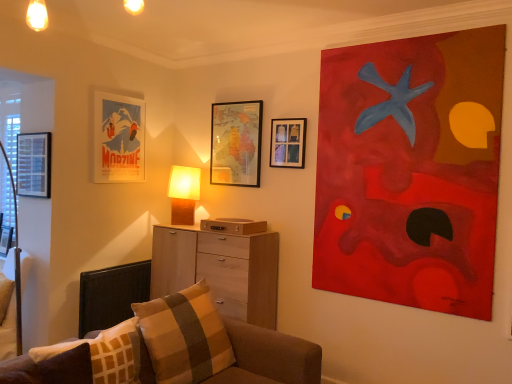
What is the approximate height of brown plaid pillow at lower left, which is the second pillow from back to front?

It is 13.04 inches.

Describe the element at coordinates (184, 336) in the screenshot. I see `plaid fabric pillow at lower center, the 2th pillow viewed from the front` at that location.

Image resolution: width=512 pixels, height=384 pixels. I want to click on black fabric swivel chair at lower left, so click(x=111, y=295).

The height and width of the screenshot is (384, 512). Describe the element at coordinates (220, 270) in the screenshot. I see `light wood chest of drawers at center` at that location.

Measure the distance between point [167,243] and camera.

Point [167,243] and camera are 3.54 meters apart from each other.

Identify the location of wooden map at upper center, acting as the 4th picture frame starting from the left. Image resolution: width=512 pixels, height=384 pixels. (236, 143).

Looking at this image, which is closer to the camera, (349, 156) or (103, 111)?

Point (349, 156) is positioned closer to the camera compared to point (103, 111).

This screenshot has height=384, width=512. In order to click on picture frame that is the 3rd object located in front of the matte paper poster at upper left, arranged as the fourth picture frame when viewed from the right in this screenshot , I will do `click(410, 171)`.

Considering the sizes of objects acrylic painting at upper right, the sixth picture frame in the left-to-right sequence, and matte paper poster at upper left, which is counted as the 3th picture frame, starting from the left, in the image provided, who is thinner, acrylic painting at upper right, the sixth picture frame in the left-to-right sequence, or matte paper poster at upper left, which is counted as the 3th picture frame, starting from the left,?

With smaller width is matte paper poster at upper left, which is counted as the 3th picture frame, starting from the left.

Is point (174, 243) closer or farther from the camera than point (109, 95)?

Point (174, 243) appears to be farther away from the viewer than point (109, 95).

Considering the relative sizes of light wood chest of drawers at center and matte paper poster at upper left, arranged as the fourth picture frame when viewed from the right, in the image provided, is light wood chest of drawers at center wider than matte paper poster at upper left, arranged as the fourth picture frame when viewed from the right,?

Yes.

Is the position of light wood chest of drawers at center more distant than that of matte paper poster at upper left, which is counted as the 3th picture frame, starting from the left?

That is False.

Can you confirm if acrylic painting at upper right, the sixth picture frame in the left-to-right sequence, is taller than matte black picture frame at left, the 2th picture frame viewed from the left?

Indeed, acrylic painting at upper right, the sixth picture frame in the left-to-right sequence, has a greater height compared to matte black picture frame at left, the 2th picture frame viewed from the left.

Which point is more distant from viewer, (359, 254) or (23, 167)?

The point (23, 167) is behind.

How different are the orientations of acrylic painting at upper right, the sixth picture frame in the left-to-right sequence, and matte black picture frame at left, the 5th picture frame when ordered from right to left, in degrees?

The angle between the facing direction of acrylic painting at upper right, the sixth picture frame in the left-to-right sequence, and the facing direction of matte black picture frame at left, the 5th picture frame when ordered from right to left, is 0.594 degrees.

Is acrylic painting at upper right, which is the 1th picture frame from right to left, aimed at matte black picture frame at left, the 5th picture frame when ordered from right to left?

No, acrylic painting at upper right, which is the 1th picture frame from right to left, is not aimed at matte black picture frame at left, the 5th picture frame when ordered from right to left.

Does brown fabric couch at lower right have a greater height compared to light wood chest of drawers at center?

No, brown fabric couch at lower right is not taller than light wood chest of drawers at center.

Is light wood chest of drawers at center located within brown fabric couch at lower right?

No.

Measure the distance from brown fabric couch at lower right to light wood chest of drawers at center.

brown fabric couch at lower right and light wood chest of drawers at center are 30.38 inches apart from each other.

Is brown fabric couch at lower right in contact with light wood chest of drawers at center?

No, brown fabric couch at lower right is not touching light wood chest of drawers at center.

Considering the sizes of objects matte black picture frame at left, the 5th picture frame when ordered from right to left, and plaid fabric pillow at lower center, the first pillow from the back, in the image provided, who is wider, matte black picture frame at left, the 5th picture frame when ordered from right to left, or plaid fabric pillow at lower center, the first pillow from the back,?

plaid fabric pillow at lower center, the first pillow from the back, is wider.

Does point (48, 186) lie behind point (136, 312)?

Yes, it is behind point (136, 312).

Is plaid fabric pillow at lower center, the 2th pillow viewed from the front, a part of matte black picture frame at left, the 2th picture frame viewed from the left?

No, plaid fabric pillow at lower center, the 2th pillow viewed from the front, is not surrounded by matte black picture frame at left, the 2th picture frame viewed from the left.

From the image's perspective, which object appears higher, matte black picture frame at left, the 5th picture frame when ordered from right to left, or plaid fabric pillow at lower center, the first pillow from the back?

matte black picture frame at left, the 5th picture frame when ordered from right to left, from the image's perspective.

Is brown fabric couch at lower right positioned before wooden map at upper center, acting as the third picture frame starting from the right?

Yes.

Based on the photo, from a real-world perspective, is brown fabric couch at lower right under wooden map at upper center, acting as the third picture frame starting from the right?

Indeed, from a real-world perspective, brown fabric couch at lower right is positioned beneath wooden map at upper center, acting as the third picture frame starting from the right.

Is brown fabric couch at lower right bigger than wooden map at upper center, acting as the 4th picture frame starting from the left?

Correct, brown fabric couch at lower right is larger in size than wooden map at upper center, acting as the 4th picture frame starting from the left.

Would you say brown fabric couch at lower right is a long distance from wooden map at upper center, acting as the 4th picture frame starting from the left?

Yes, brown fabric couch at lower right is far from wooden map at upper center, acting as the 4th picture frame starting from the left.

From a real-world perspective, which is physically above, light wood chest of drawers at center or wooden map at upper center, acting as the 4th picture frame starting from the left?

From a 3D spatial view, wooden map at upper center, acting as the 4th picture frame starting from the left, is above.

Is there a large distance between light wood chest of drawers at center and wooden map at upper center, acting as the third picture frame starting from the right?

That's not correct — light wood chest of drawers at center is a little close to wooden map at upper center, acting as the third picture frame starting from the right.

Does light wood chest of drawers at center have a lesser height compared to wooden map at upper center, acting as the 4th picture frame starting from the left?

Incorrect, the height of light wood chest of drawers at center does not fall short of that of wooden map at upper center, acting as the 4th picture frame starting from the left.

Starting from the acrylic painting at upper right, which is the 1th picture frame from right to left, which picture frame is the 3rd one behind? Please provide its 2D coordinates.

[(119, 137)]

In order to click on chest of drawers to the right of matte paper poster at upper left, arranged as the fourth picture frame when viewed from the right in this screenshot , I will do `click(220, 270)`.

Based on their spatial positions, is brown plaid pillow at lower left, arranged as the 1th pillow when viewed from the front, or wooden map at upper center, acting as the 4th picture frame starting from the left, closer to plaid fabric pillow at lower center, the first pillow from the back?

brown plaid pillow at lower left, arranged as the 1th pillow when viewed from the front, lies closer to plaid fabric pillow at lower center, the first pillow from the back, than the other object.

Which object lies nearer to the anchor point matte paper poster at upper left, arranged as the fourth picture frame when viewed from the right, matte wooden table lamp at center or metallic silver picture frame at left, positioned as the sixth picture frame in right-to-left order?

Among the two, matte wooden table lamp at center is located nearer to matte paper poster at upper left, arranged as the fourth picture frame when viewed from the right.

Estimate the real-world distances between objects in this image. Which object is further from light wood chest of drawers at center, matte paper poster at upper left, which is counted as the 3th picture frame, starting from the left, or black fabric swivel chair at lower left?

matte paper poster at upper left, which is counted as the 3th picture frame, starting from the left, lies further to light wood chest of drawers at center than the other object.

Looking at the image, which one is located closer to matte wooden picture frame at upper center, acting as the 5th picture frame starting from the left, matte paper poster at upper left, which is counted as the 3th picture frame, starting from the left, or brown plaid pillow at lower left, which is the second pillow from back to front?

Based on the image, matte paper poster at upper left, which is counted as the 3th picture frame, starting from the left, appears to be nearer to matte wooden picture frame at upper center, acting as the 5th picture frame starting from the left.

From the image, which object appears to be nearer to brown fabric couch at lower right, matte paper poster at upper left, arranged as the fourth picture frame when viewed from the right, or black fabric swivel chair at lower left?

black fabric swivel chair at lower left lies closer to brown fabric couch at lower right than the other object.

Looking at the image, which one is located closer to metallic silver picture frame at left, positioned as the sixth picture frame in right-to-left order, matte black picture frame at left, the 2th picture frame viewed from the left, or plaid fabric pillow at lower center, the 2th pillow viewed from the front?

Among the two, matte black picture frame at left, the 2th picture frame viewed from the left, is located nearer to metallic silver picture frame at left, positioned as the sixth picture frame in right-to-left order.

Looking at this image, estimate the real-world distances between objects in this image. Which object is closer to acrylic painting at upper right, the sixth picture frame in the left-to-right sequence, matte wooden picture frame at upper center, acting as the 5th picture frame starting from the left, or matte black picture frame at left, the 2th picture frame viewed from the left?

matte wooden picture frame at upper center, acting as the 5th picture frame starting from the left, is closer to acrylic painting at upper right, the sixth picture frame in the left-to-right sequence.

Considering their positions, is wooden map at upper center, acting as the 4th picture frame starting from the left, positioned closer to brown plaid pillow at lower left, which is the second pillow from back to front, than acrylic painting at upper right, the sixth picture frame in the left-to-right sequence?

Based on the image, wooden map at upper center, acting as the 4th picture frame starting from the left, appears to be nearer to brown plaid pillow at lower left, which is the second pillow from back to front.

Where is `the chest of drawers situated between matte black picture frame at left, the 5th picture frame when ordered from right to left, and acrylic painting at upper right, the sixth picture frame in the left-to-right sequence, from left to right`? The image size is (512, 384). the chest of drawers situated between matte black picture frame at left, the 5th picture frame when ordered from right to left, and acrylic painting at upper right, the sixth picture frame in the left-to-right sequence, from left to right is located at coordinates (220, 270).

This screenshot has height=384, width=512. I want to click on chest of drawers between plaid fabric pillow at lower center, the first pillow from the back, and black fabric swivel chair at lower left from front to back, so click(x=220, y=270).

Locate an element on the screen. the chest of drawers between wooden map at upper center, acting as the third picture frame starting from the right, and black fabric swivel chair at lower left vertically is located at coordinates (220, 270).

Locate an element on the screen. The width and height of the screenshot is (512, 384). the chest of drawers situated between plaid fabric pillow at lower center, the first pillow from the back, and acrylic painting at upper right, which is the 1th picture frame from right to left, from left to right is located at coordinates (220, 270).